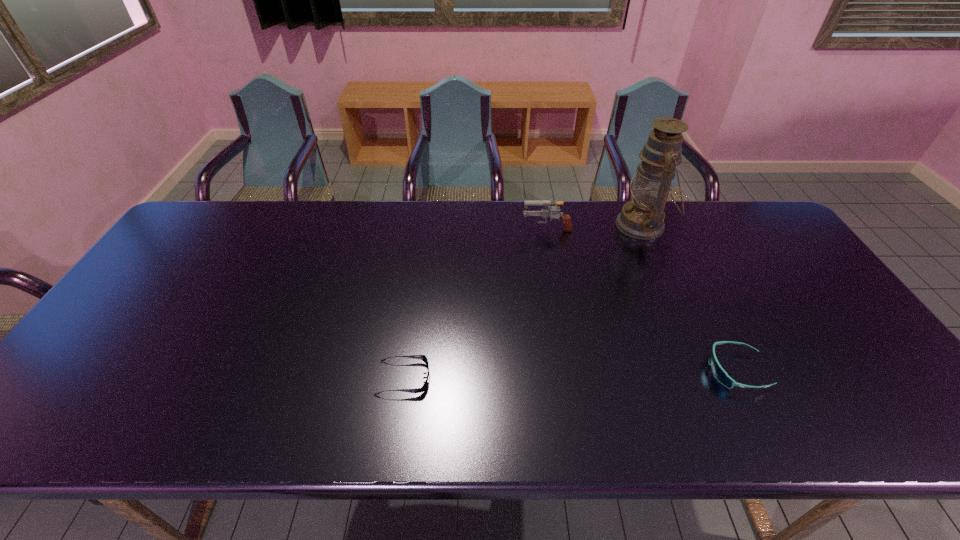
What are the coordinates of `the tallest object` in the screenshot? It's located at (643, 218).

Locate an element on the screen. This screenshot has width=960, height=540. the third shortest object is located at coordinates (545, 213).

Find the location of a particular element. gun is located at coordinates (545, 213).

This screenshot has height=540, width=960. In order to click on the right sunglasses in this screenshot , I will do `click(719, 373)`.

At what (x,y) coordinates should I click in order to perform the action: click on the third tallest object. Please return your answer as a coordinate pair (x, y). This screenshot has width=960, height=540. Looking at the image, I should click on (719, 373).

Image resolution: width=960 pixels, height=540 pixels. What are the coordinates of `the left sunglasses` in the screenshot? It's located at (422, 357).

The image size is (960, 540). Identify the location of the shortest object. (422, 357).

Identify the location of vacant point located on the left of the oil lamp. (586, 225).

Identify the location of free space located 0.320m at the barrel end of the second tallest object. The height and width of the screenshot is (540, 960). (424, 228).

You are a GUI agent. You are given a task and a screenshot of the screen. Output one action in this format:
    pyautogui.click(x=<x>, y=<y>)
    Task: Click on the free space located at the barrel end of the second tallest object
    
    Given the screenshot: What is the action you would take?
    pyautogui.click(x=440, y=228)